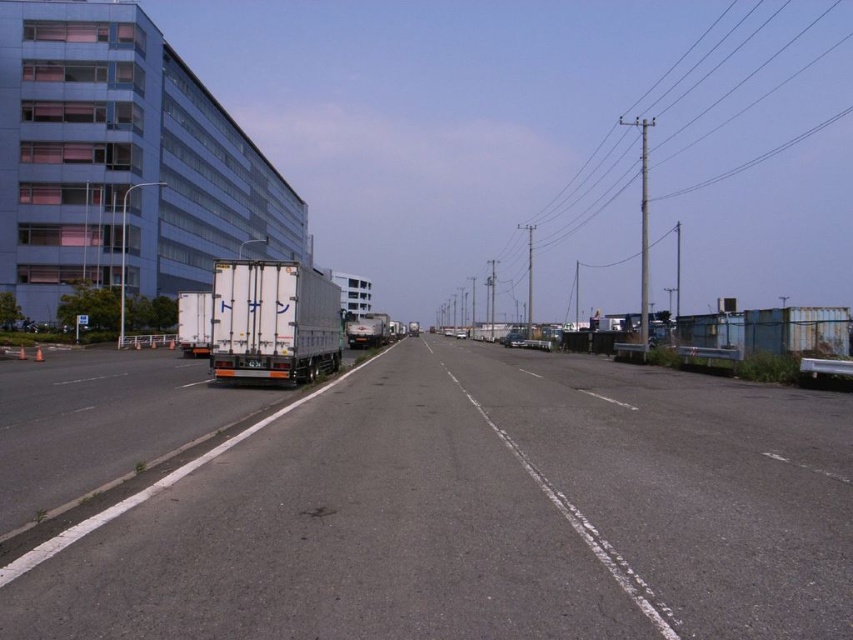
You are standing at the intersection of the road and the building. Which direction should you walk to reach the black asphalt highway at center?

Walk straight ahead towards the center of the road to reach the black asphalt highway at center.

You are standing at the side of the road and want to cross the black asphalt highway at center. The safety regulations state that you must be at least 5 meters away from the road to be considered safe. Are you within a safe distance according to the regulations?

The distance between you and the black asphalt highway at center is 4.21 meters, which is less than the required 5 meters for safety. Therefore, you are not within a safe distance according to the regulations.